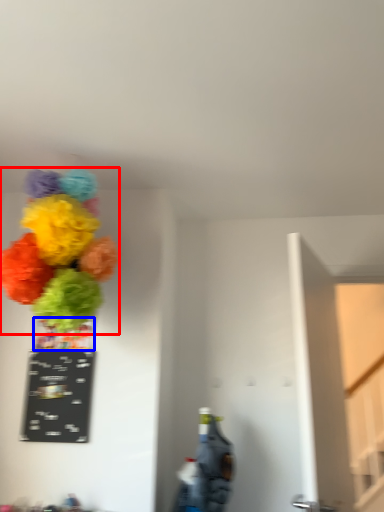
Question: Among these objects, which one is nearest to the camera, flower (highlighted by a red box) or vase (highlighted by a blue box)?

Choices:
 (A) flower
 (B) vase

Answer: (A)